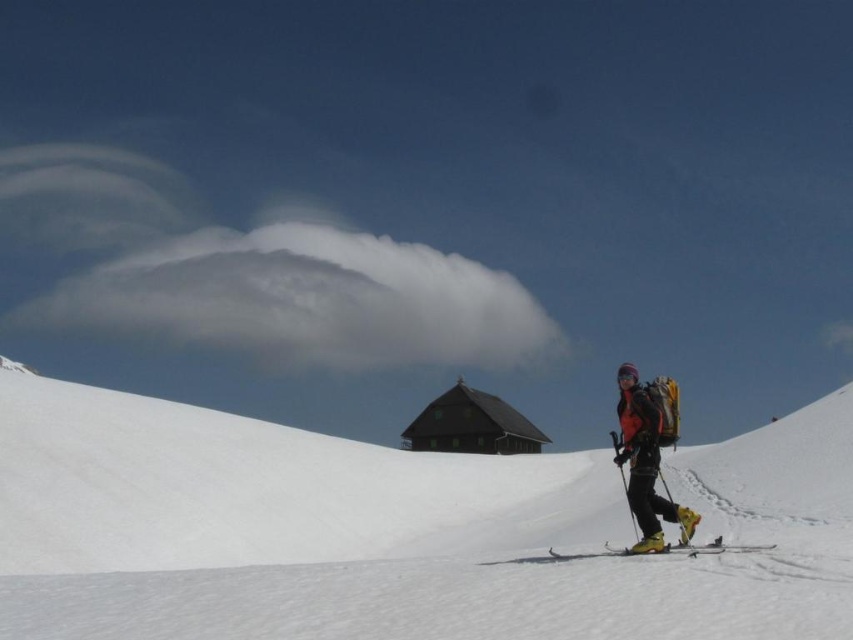
Question: From the image, what is the correct spatial relationship of orange fabric jacket at right in relation to dark brown wooden hut at center?

Choices:
 (A) above
 (B) below

Answer: (A)

Question: Among these points, which one is nearest to the camera?

Choices:
 (A) (117, 332)
 (B) (105, 609)
 (C) (654, 465)
 (D) (523, 448)

Answer: (B)

Question: Does white powder snow at center have a smaller size compared to orange fabric jacket at right?

Choices:
 (A) no
 (B) yes

Answer: (A)

Question: Which of the following is the farthest from the observer?

Choices:
 (A) (467, 500)
 (B) (715, 552)
 (C) (325, 252)
 (D) (480, 413)

Answer: (C)

Question: Can you confirm if white powder snow at center is positioned to the right of orange fabric jacket at right?

Choices:
 (A) yes
 (B) no

Answer: (B)

Question: Which object is farther from the camera taking this photo?

Choices:
 (A) white fluffy cloud at upper center
 (B) dark brown wooden hut at center

Answer: (A)